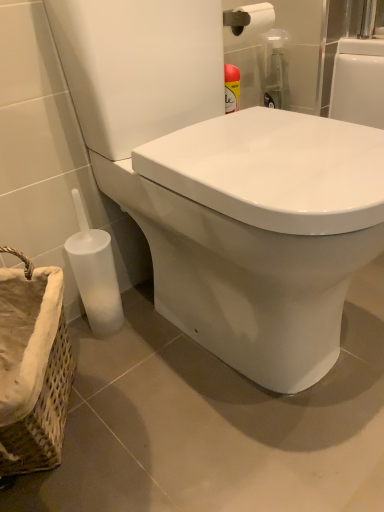
At what (x,y) coordinates should I click in order to perform the action: click on vacant space that's between white glossy toilet at lower left and woven fabric basket at lower left. Please return your answer as a coordinate pair (x, y). This screenshot has width=384, height=512. Looking at the image, I should click on (166, 416).